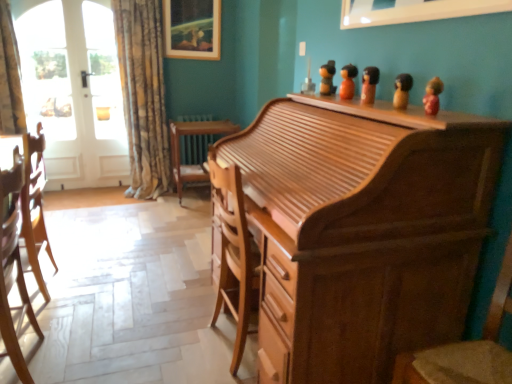
Question: Is wooden picture frame at upper center, which is the first picture frame in back-to-front order, in front of light brown wood chair at left, which is counted as the 1th chair, starting from the back?

Choices:
 (A) yes
 (B) no

Answer: (B)

Question: From the image's perspective, is wooden picture frame at upper center, the second picture frame when ordered from bottom to top, on top of light brown wood chair at left, the 1th chair from the left?

Choices:
 (A) yes
 (B) no

Answer: (A)

Question: Does wooden picture frame at upper center, which is the 2th picture frame from front to back, have a greater width compared to light brown wood chair at left, which is counted as the 1th chair, starting from the back?

Choices:
 (A) no
 (B) yes

Answer: (A)

Question: Can you confirm if wooden picture frame at upper center, which is the 2th picture frame from front to back, is positioned to the right of light brown wood chair at left, acting as the 2th chair starting from the right?

Choices:
 (A) no
 (B) yes

Answer: (B)

Question: From the image's perspective, would you say wooden picture frame at upper center, the 1th picture frame in the left-to-right sequence, is shown under light brown wood chair at left, which is counted as the 1th chair, starting from the back?

Choices:
 (A) yes
 (B) no

Answer: (B)

Question: From their relative heights in the image, would you say textured beige curtain at left is taller or shorter than light brown wood chair at left, acting as the 2th chair starting from the right?

Choices:
 (A) tall
 (B) short

Answer: (A)

Question: In the image, is textured beige curtain at left positioned in front of or behind light brown wood chair at left, which is counted as the 1th chair, starting from the back?

Choices:
 (A) behind
 (B) front

Answer: (A)

Question: Is textured beige curtain at left bigger or smaller than light brown wood chair at left, placed as the second chair when sorted from front to back?

Choices:
 (A) small
 (B) big

Answer: (B)

Question: From a real-world perspective, is textured beige curtain at left above or below light brown wood chair at left, placed as the second chair when sorted from front to back?

Choices:
 (A) above
 (B) below

Answer: (A)

Question: Is white glossy picture frame at upper center, which is the first picture frame from right to left, situated inside wooden picture frame at upper center, which is the 2th picture frame from front to back, or outside?

Choices:
 (A) outside
 (B) inside

Answer: (A)

Question: Looking at their shapes, would you say white glossy picture frame at upper center, arranged as the second picture frame when viewed from the top, is wider or thinner than wooden picture frame at upper center, which appears as the 1th picture frame when viewed from the top?

Choices:
 (A) thin
 (B) wide

Answer: (A)

Question: Relative to wooden picture frame at upper center, which is counted as the 2th picture frame, starting from the right, is white glossy picture frame at upper center, arranged as the second picture frame when viewed from the top, in front or behind?

Choices:
 (A) behind
 (B) front

Answer: (B)

Question: From the image's perspective, is white glossy picture frame at upper center, which appears as the second picture frame when viewed from the left, positioned above or below wooden picture frame at upper center, the second picture frame when ordered from bottom to top?

Choices:
 (A) above
 (B) below

Answer: (B)

Question: Would you say wooden roll-top desk at center is inside or outside white glass door at left?

Choices:
 (A) outside
 (B) inside

Answer: (A)

Question: Is point (466, 173) positioned closer to the camera than point (123, 135)?

Choices:
 (A) farther
 (B) closer

Answer: (B)